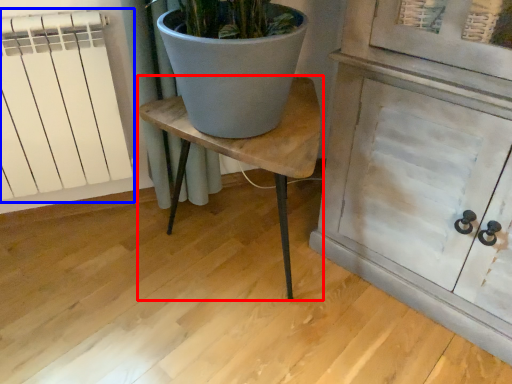
Question: Which object is further to the camera taking this photo, table (highlighted by a red box) or radiator (highlighted by a blue box)?

Choices:
 (A) table
 (B) radiator

Answer: (B)